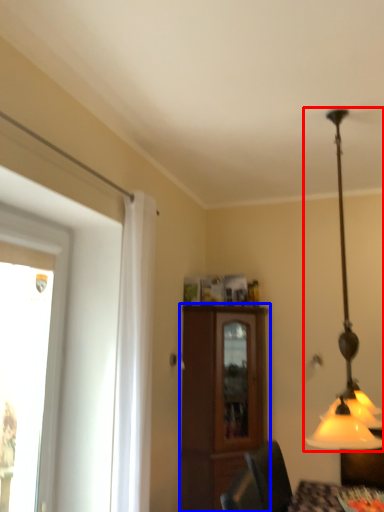
Question: Among these objects, which one is farthest to the camera, lamp (highlighted by a red box) or cabinetry (highlighted by a blue box)?

Choices:
 (A) lamp
 (B) cabinetry

Answer: (B)